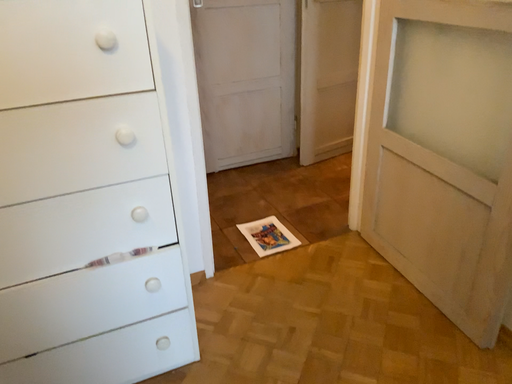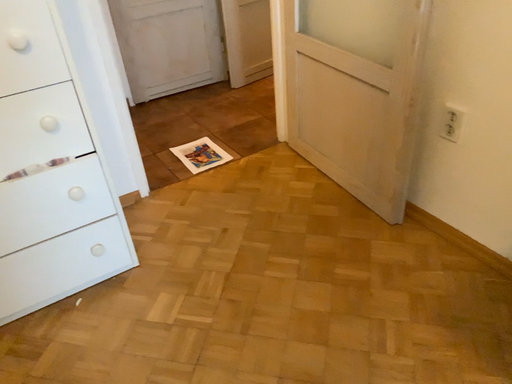
Question: How did the camera likely rotate when shooting the video?

Choices:
 (A) rotated downward
 (B) rotated upward

Answer: (A)